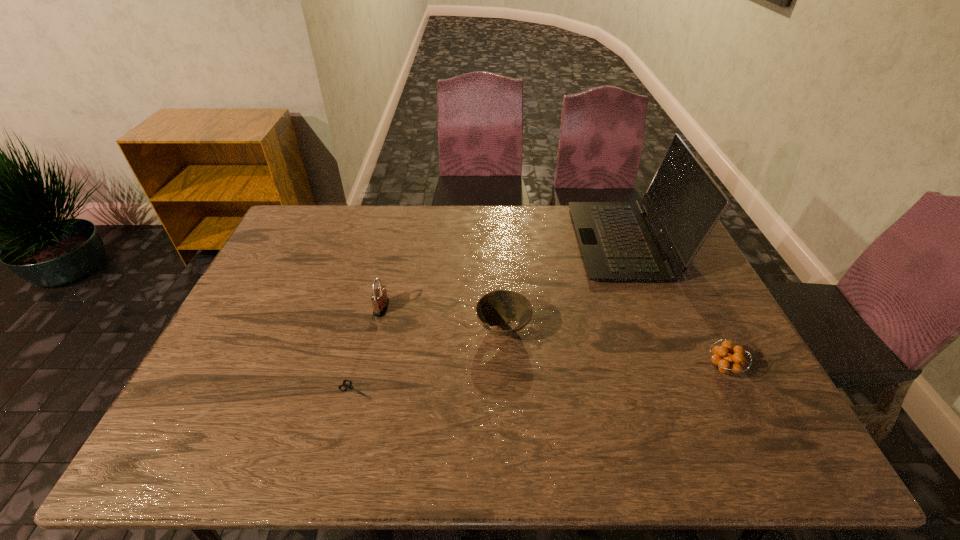
Where is `vacant space at the far left corner`? The height and width of the screenshot is (540, 960). vacant space at the far left corner is located at coordinates (305, 219).

At what (x,y) coordinates should I click in order to perform the action: click on empty space that is in between the padlock and the third object from left to right. Please return your answer as a coordinate pair (x, y). Looking at the image, I should click on (443, 318).

Locate an element on the screen. Image resolution: width=960 pixels, height=540 pixels. free space between the padlock and the tallest object is located at coordinates (503, 275).

Where is `blank region between the third object from left to right and the shears`? blank region between the third object from left to right and the shears is located at coordinates (429, 359).

This screenshot has height=540, width=960. I want to click on vacant space that's between the padlock and the laptop computer, so click(503, 275).

Where is `free area in between the farthest object and the padlock`? The height and width of the screenshot is (540, 960). free area in between the farthest object and the padlock is located at coordinates (503, 275).

This screenshot has width=960, height=540. Find the location of `vacant point located between the padlock and the tallest object`. vacant point located between the padlock and the tallest object is located at coordinates (503, 275).

Locate an element on the screen. This screenshot has height=540, width=960. empty space that is in between the tallest object and the third object from left to right is located at coordinates (564, 285).

Locate an element on the screen. This screenshot has height=540, width=960. empty space between the third object from right to left and the laptop computer is located at coordinates (564, 285).

The image size is (960, 540). I want to click on unoccupied position between the padlock and the bowl, so click(x=443, y=318).